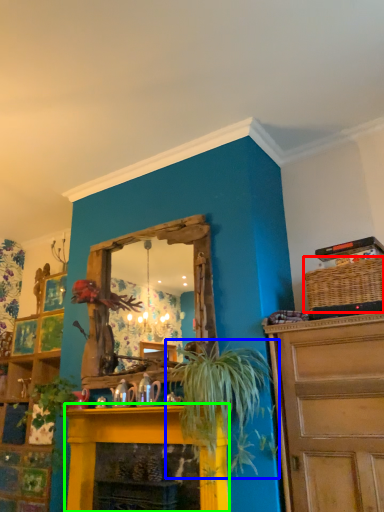
Question: Which object is positioned closest to basket (highlighted by a red box)? Select from houseplant (highlighted by a blue box) and fireplace (highlighted by a green box).

Choices:
 (A) houseplant
 (B) fireplace

Answer: (A)